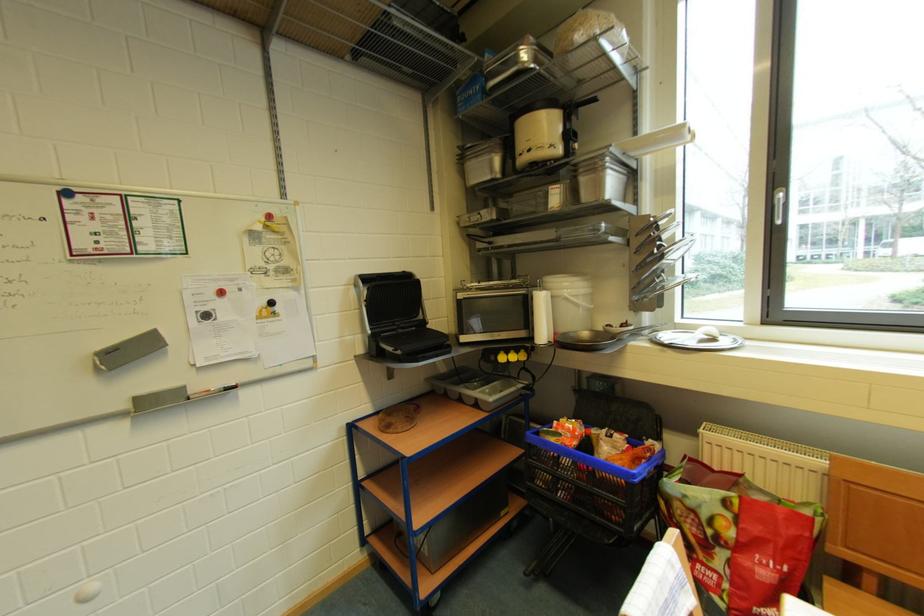
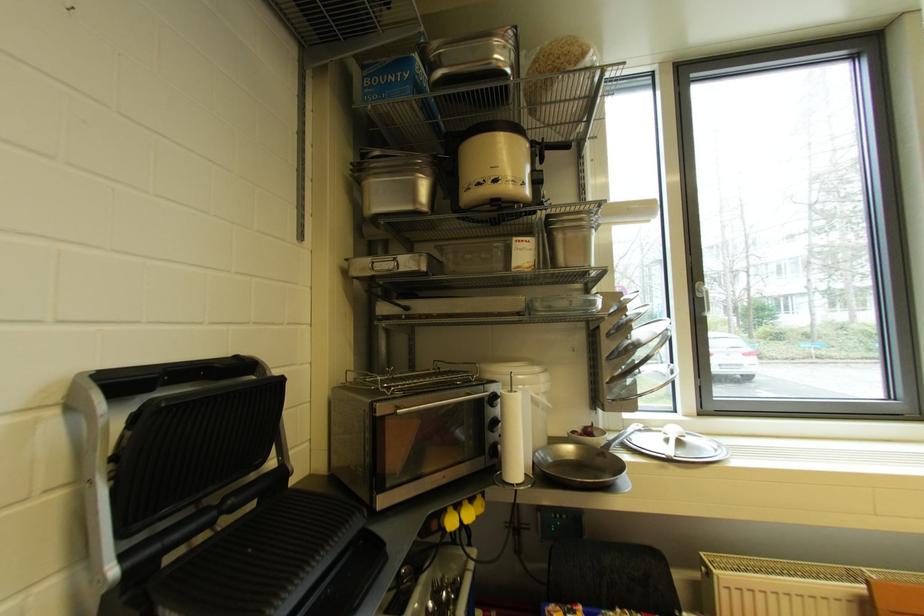
In the second image, find the point that corresponds to point (490, 103) in the first image.

(420, 97)